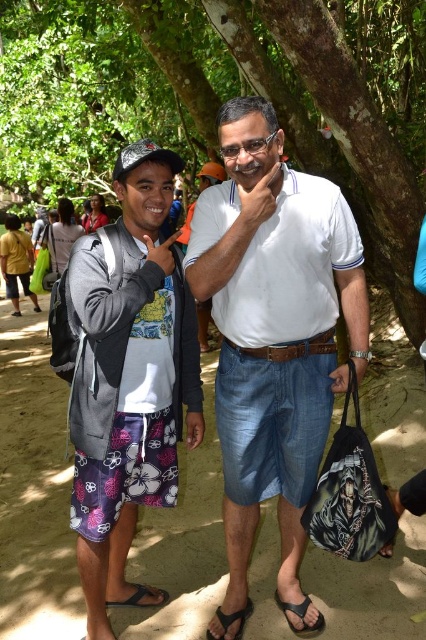
You are a photographer trying to capture a candid shot of the person wearing a gray jacket over a white t shirt with a colorful graphic design. You notice a point at coordinates (273, 330). Based on the scene description, can you determine if this point is located on the gray jacket or the white cotton shirt at center?

The point (273, 330) is on the white cotton shirt at center, so it is not on the gray jacket.

Consider the image. You are planning to take a photo of the rough bark tree at center and the gray fleece jacket at left. To ensure both are in frame, should you adjust your camera to a wider angle or a narrower angle?

The rough bark tree at center is to the left of the gray fleece jacket at left, so you should adjust your camera to a wider angle to capture both in the frame.